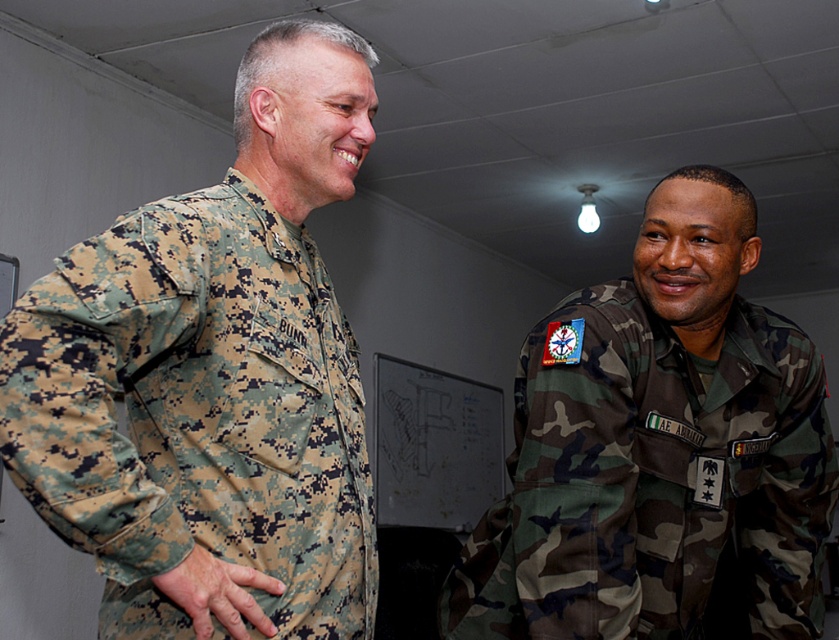
You are a photographer standing in front of the two military personnel in the scene. You want to take a closeup photo of the digital camouflage uniform at left without including the other person. Given that your camera has a focal length of 50mm and you need a minimum distance of 30 inches to avoid distortion, can you safely take the photo?

The digital camouflage uniform at left is 33.37 inches away from the viewer, which is more than the required 30 inches. Therefore, you can safely take the closeup photo without distortion.

You are a tailor who needs to determine which uniform requires more fabric to make between the digital camouflage uniform at left and the camo uniform at right. Which one would need more fabric?

The camo uniform at right requires more fabric because it is thicker than the digital camouflage uniform at left.